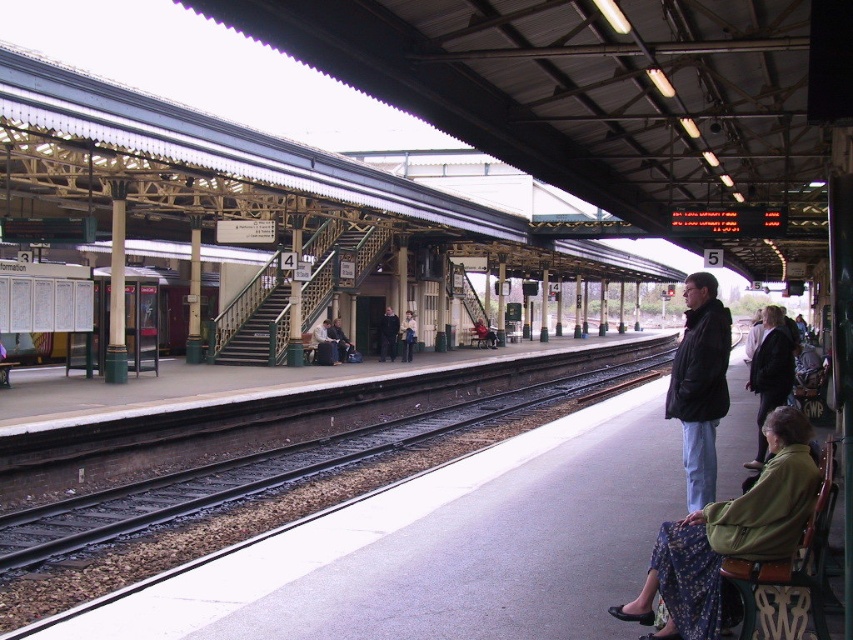
You are standing on the train station platform and need to walk to a specific location. You see two points marked on the platform floor, point (392, 333) and point (409, 337). If you want to reach the point that is closer to the edge of the platform, which point should you go to?

Point (392, 333) is in front of point (409, 337), so it is closer to the edge of the platform. Therefore, you should go to point (392, 333).

You are standing at the train station platform and want to board the train that will arrive on the dark gray metal train track at center. Where should you position yourself relative to the white safety line to ensure you can see the track clearly?

To ensure you can see the dark gray metal train track at center clearly, you should position yourself close to the white safety line, as the track is located at point (264, 470), which is near the edge of the platform.